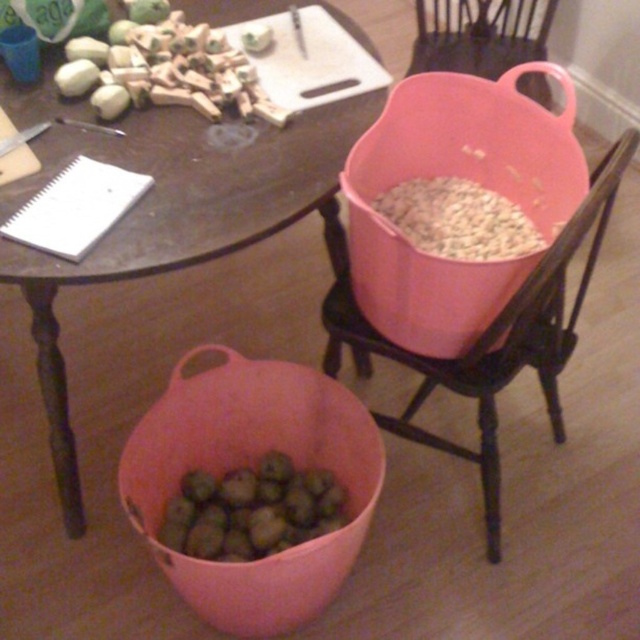
You have a small container that can only fit items up to 5 cm in width. You need to transfer some items from the green matte wooden pieces at upper left and the green matte nuts at lower center into the container. Which items should you choose to ensure they fit?

The green matte nuts at lower center should be chosen because the green matte wooden pieces at upper left might be wider than them, so the nuts are more likely to fit in the container.

You are an interior designer who needs to place a small decorative item at the point labeled as point [164,70]. Based on the scene description, what object is located at this point?

The point [164,70] corresponds to the green matte wooden pieces at upper left.